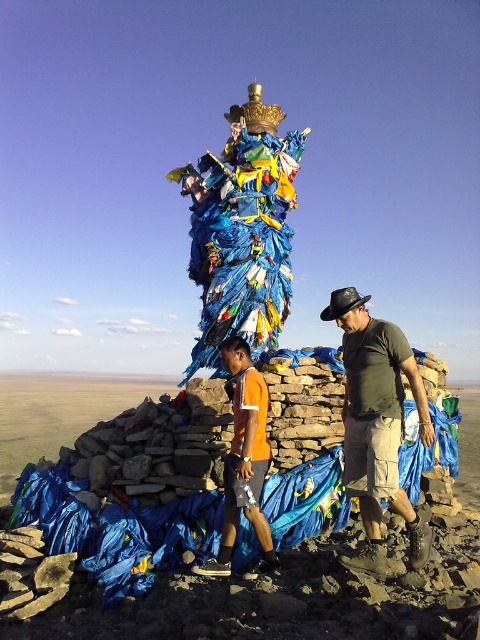
Who is more distant from viewer, (379, 502) or (241, 492)?

Point (241, 492)

Who is positioned more to the right, matte black shirt at center or orange fabric shorts at center?

Positioned to the right is matte black shirt at center.

Is point (368, 554) positioned behind point (252, 572)?

No, it is in front of (252, 572).

I want to click on matte black shirt at center, so click(x=376, y=424).